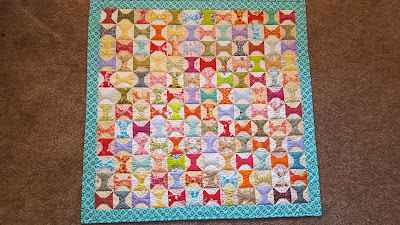
The width and height of the screenshot is (400, 225). In order to click on carpet in this screenshot , I will do (57, 136), (350, 104).